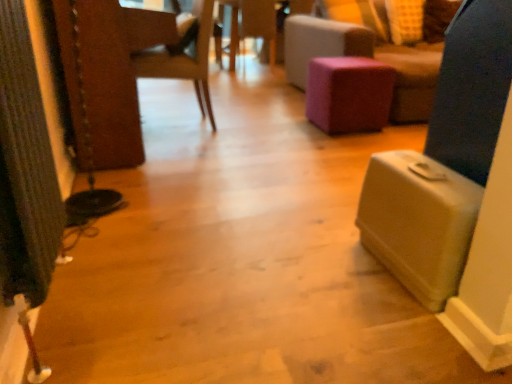
Question: From the image's perspective, is wooden chair at center located beneath wooden side table at center?

Choices:
 (A) no
 (B) yes

Answer: (B)

Question: Is wooden side table at center located within wooden chair at center?

Choices:
 (A) yes
 (B) no

Answer: (B)

Question: Can you confirm if wooden chair at center is positioned to the right of wooden side table at center?

Choices:
 (A) no
 (B) yes

Answer: (A)

Question: From a real-world perspective, is wooden chair at center located higher than wooden side table at center?

Choices:
 (A) no
 (B) yes

Answer: (B)

Question: From a real-world perspective, is wooden chair at center physically below wooden side table at center?

Choices:
 (A) no
 (B) yes

Answer: (A)

Question: Choose the correct answer: Is purple fabric stool at center inside wooden side table at center or outside it?

Choices:
 (A) inside
 (B) outside

Answer: (B)

Question: In terms of height, does purple fabric stool at center look taller or shorter compared to wooden side table at center?

Choices:
 (A) tall
 (B) short

Answer: (B)

Question: In the image, is purple fabric stool at center on the left side or the right side of wooden side table at center?

Choices:
 (A) left
 (B) right

Answer: (B)

Question: From the image's perspective, is purple fabric stool at center located above or below wooden side table at center?

Choices:
 (A) below
 (B) above

Answer: (A)

Question: From the image's perspective, is wooden chair at center located above or below purple fabric ottoman at center?

Choices:
 (A) above
 (B) below

Answer: (B)

Question: From a real-world perspective, is wooden chair at center above or below purple fabric ottoman at center?

Choices:
 (A) below
 (B) above

Answer: (A)

Question: Looking at the image, does wooden chair at center seem bigger or smaller compared to purple fabric ottoman at center?

Choices:
 (A) big
 (B) small

Answer: (B)

Question: Based on their positions, is wooden chair at center located to the left or right of purple fabric ottoman at center?

Choices:
 (A) right
 (B) left

Answer: (B)

Question: Is point (428, 198) positioned closer to the camera than point (202, 39)?

Choices:
 (A) closer
 (B) farther

Answer: (A)

Question: In the image, is beige plastic suitcase at lower right positioned in front of or behind wooden chair at center?

Choices:
 (A) front
 (B) behind

Answer: (A)